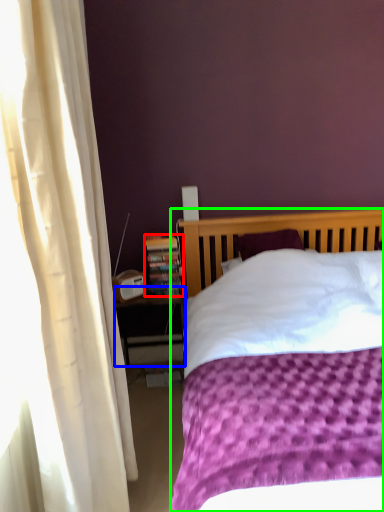
Question: Which is farther away from paperback book (highlighted by a red box)? nightstand (highlighted by a blue box) or bed (highlighted by a green box)?

Choices:
 (A) nightstand
 (B) bed

Answer: (B)